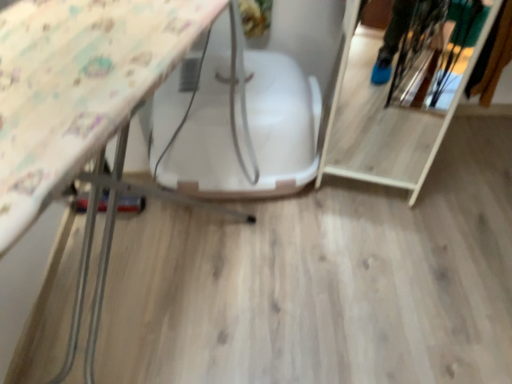
Where is `wooden shelf at right`? The width and height of the screenshot is (512, 384). wooden shelf at right is located at coordinates (382, 119).

The height and width of the screenshot is (384, 512). What do you see at coordinates (382, 119) in the screenshot?
I see `wooden shelf at right` at bounding box center [382, 119].

The height and width of the screenshot is (384, 512). What do you see at coordinates (250, 131) in the screenshot? I see `white plastic swivel chair at center` at bounding box center [250, 131].

What are the coordinates of `white plastic swivel chair at center` in the screenshot? It's located at (250, 131).

Image resolution: width=512 pixels, height=384 pixels. I want to click on wooden shelf at right, so click(382, 119).

Is white plastic swivel chair at center at the left side of wooden shelf at right?

Indeed, white plastic swivel chair at center is positioned on the left side of wooden shelf at right.

From the picture: Is white plastic swivel chair at center positioned behind wooden shelf at right?

Yes, it is behind wooden shelf at right.

Between point (192, 151) and point (367, 168), which one is positioned in front?

Point (192, 151)

From the image's perspective, between white plastic swivel chair at center and wooden shelf at right, who is located below?

From the image's view, white plastic swivel chair at center is below.

From a real-world perspective, is white plastic swivel chair at center located beneath wooden shelf at right?

Yes, from a real-world perspective, white plastic swivel chair at center is beneath wooden shelf at right.

Based on the photo, between white plastic swivel chair at center and wooden shelf at right, which one has larger width?

With larger width is white plastic swivel chair at center.

Does white plastic swivel chair at center have a greater height compared to wooden shelf at right?

Yes.

Is white plastic swivel chair at center bigger than wooden shelf at right?

Yes.

Is wooden shelf at right completely or partially inside white plastic swivel chair at center?

Definitely not — wooden shelf at right is not inside white plastic swivel chair at center.

Is the surface of white plastic swivel chair at center in direct contact with wooden shelf at right?

No, white plastic swivel chair at center is not beside wooden shelf at right.

Is white plastic swivel chair at center facing away from wooden shelf at right?

No, white plastic swivel chair at center is not facing away from wooden shelf at right.

How different are the orientations of white plastic swivel chair at center and wooden shelf at right in degrees?

They differ by 27.1 degrees in their facing directions.

How much distance is there between white plastic swivel chair at center and wooden shelf at right?

A distance of 22.20 inches exists between white plastic swivel chair at center and wooden shelf at right.

Locate an element on the screen. This screenshot has width=512, height=384. shelf that is in front of the white plastic swivel chair at center is located at coordinates (382, 119).

Based on their positions, is wooden shelf at right located to the left or right of white plastic swivel chair at center?

Based on their positions, wooden shelf at right is located to the right of white plastic swivel chair at center.

Does wooden shelf at right lie in front of white plastic swivel chair at center?

That is True.

Considering the positions of points (382, 179) and (273, 156), is point (382, 179) closer to camera compared to point (273, 156)?

No, it is not.

From the image's perspective, which one is positioned lower, wooden shelf at right or white plastic swivel chair at center?

white plastic swivel chair at center, from the image's perspective.

From a real-world perspective, does wooden shelf at right stand above white plastic swivel chair at center?

Yes, from a real-world perspective, wooden shelf at right is above white plastic swivel chair at center.

Between wooden shelf at right and white plastic swivel chair at center, which one has larger width?

Wider between the two is white plastic swivel chair at center.

Which of these two, wooden shelf at right or white plastic swivel chair at center, stands taller?

white plastic swivel chair at center.

Looking at the image, does wooden shelf at right seem bigger or smaller compared to white plastic swivel chair at center?

In the image, wooden shelf at right appears to be smaller than white plastic swivel chair at center.

In the scene shown: Is white plastic swivel chair at center completely or partially inside wooden shelf at right?

No, white plastic swivel chair at center is not surrounded by wooden shelf at right.

Is wooden shelf at right with white plastic swivel chair at center?

No, wooden shelf at right is not touching white plastic swivel chair at center.

Is white plastic swivel chair at center at the back of wooden shelf at right?

That's not correct — wooden shelf at right is not looking away from white plastic swivel chair at center.

How different are the orientations of wooden shelf at right and white plastic swivel chair at center in degrees?

They differ by 27.1 degrees in their facing directions.

The width and height of the screenshot is (512, 384). What are the coordinates of `swivel chair that is below the wooden shelf at right (from the image's perspective)` in the screenshot? It's located at (250, 131).

The image size is (512, 384). I want to click on swivel chair below the wooden shelf at right (from the image's perspective), so click(250, 131).

Find the location of a particular element. swivel chair that is on the left side of wooden shelf at right is located at coordinates (250, 131).